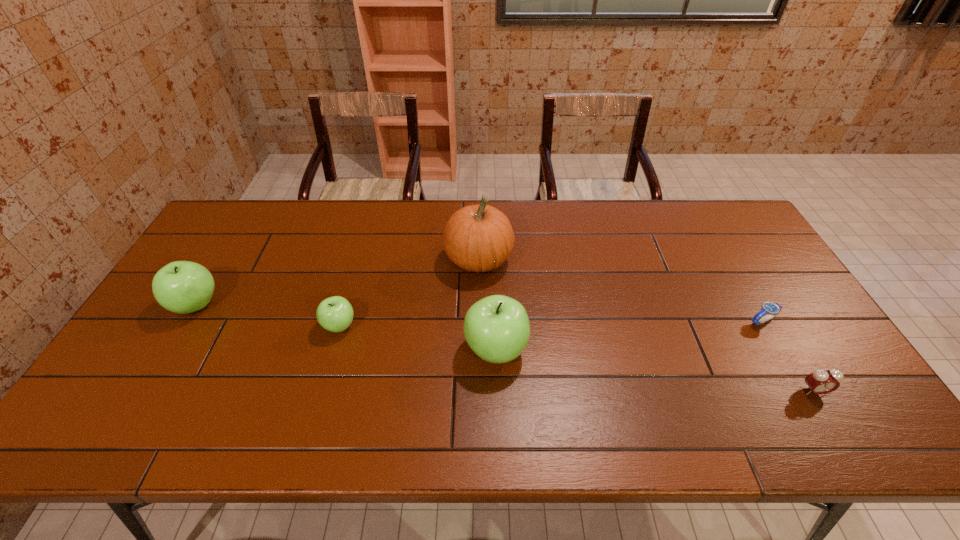
The width and height of the screenshot is (960, 540). Find the location of `the fourth shortest object`. the fourth shortest object is located at coordinates (183, 287).

Image resolution: width=960 pixels, height=540 pixels. What are the coordinates of `the leftmost apple` in the screenshot? It's located at (183, 287).

You are a GUI agent. You are given a task and a screenshot of the screen. Output one action in this format:
    pyautogui.click(x=<x>, y=<y>)
    Task: Click on the shortest apple
    Image resolution: width=960 pixels, height=540 pixels.
    Given the screenshot: What is the action you would take?
    pyautogui.click(x=335, y=314)

Where is `the fifth object from right to left`? the fifth object from right to left is located at coordinates (335, 314).

What are the coordinates of `the rightmost apple` in the screenshot? It's located at (497, 328).

You are a GUI agent. You are given a task and a screenshot of the screen. Output one action in this format:
    pyautogui.click(x=<x>, y=<y>)
    Task: Click on the farthest object
    Image resolution: width=960 pixels, height=540 pixels.
    Given the screenshot: What is the action you would take?
    pyautogui.click(x=478, y=238)

At what (x,y) coordinates should I click in order to perform the action: click on the tallest object. Please return your answer as a coordinate pair (x, y). Image resolution: width=960 pixels, height=540 pixels. Looking at the image, I should click on (478, 238).

Where is `watch`? This screenshot has height=540, width=960. watch is located at coordinates (771, 309).

At what (x,y) coordinates should I click in order to perform the action: click on alarm clock. Please return your answer as a coordinate pair (x, y). The image size is (960, 540). Looking at the image, I should click on (821, 381).

Where is `vacant space located 0.230m on the front of the fourth shortest object`? Image resolution: width=960 pixels, height=540 pixels. vacant space located 0.230m on the front of the fourth shortest object is located at coordinates (138, 400).